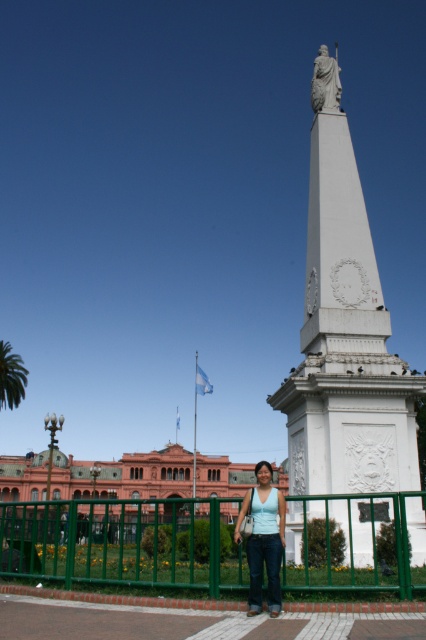
Question: Can you confirm if white marble obelisk at center is smaller than matte pink building at center?

Choices:
 (A) yes
 (B) no

Answer: (A)

Question: Can you confirm if matte pink building at center is wider than white marble statue at upper center?

Choices:
 (A) yes
 (B) no

Answer: (A)

Question: Which object appears closest to the camera in this image?

Choices:
 (A) green metal fence at lower center
 (B) light blue denim jeans at center
 (C) white marble obelisk at center

Answer: (A)

Question: Considering the real-world distances, which object is closest to the white marble obelisk at center?

Choices:
 (A) light blue denim jeans at center
 (B) green metal fence at lower center

Answer: (A)

Question: Which object is the closest to the white marble statue at upper center?

Choices:
 (A) matte pink building at center
 (B) green metal fence at lower center
 (C) light blue denim jeans at center

Answer: (C)

Question: Can you confirm if green metal fence at lower center is positioned below light blue denim jeans at center?

Choices:
 (A) yes
 (B) no

Answer: (A)